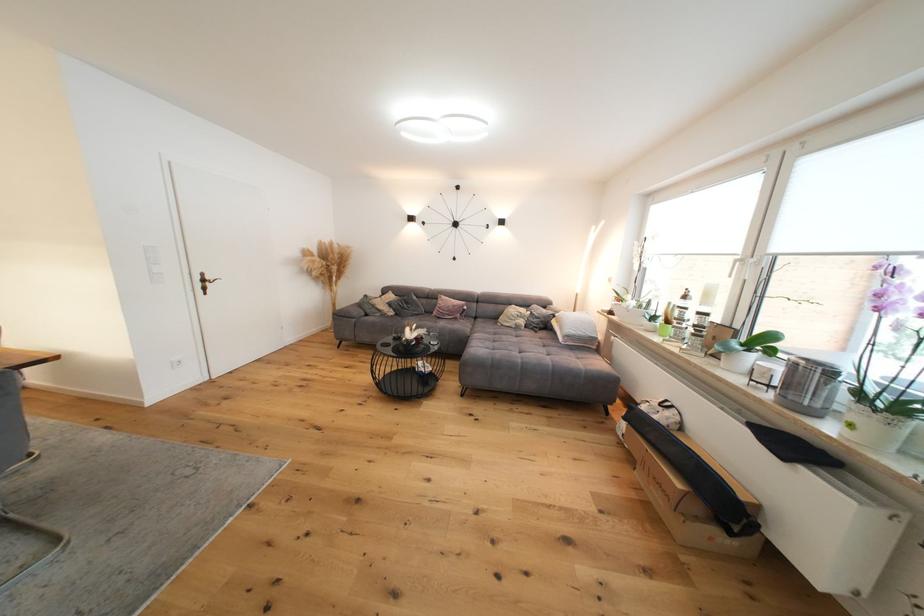
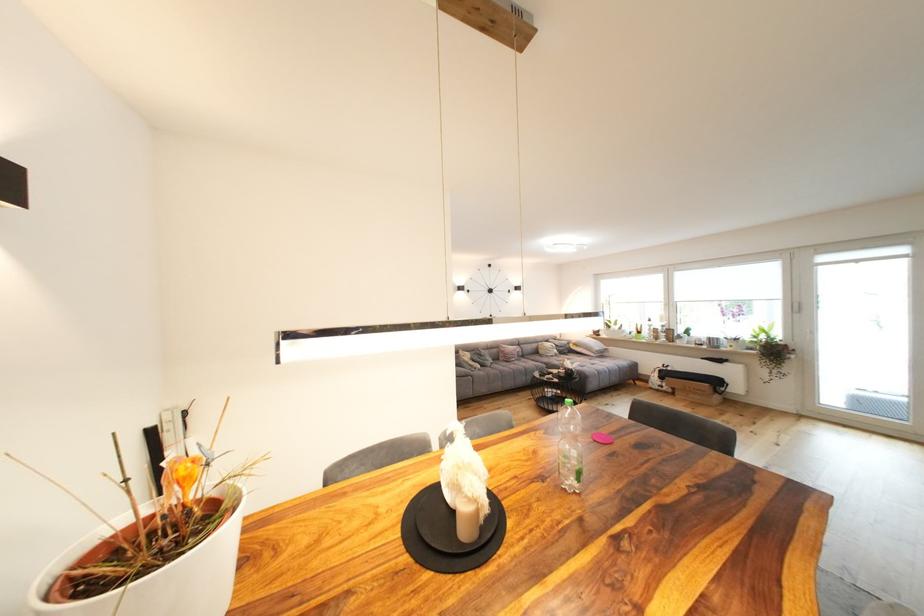
Question: I am providing you with two images of the same scene from different viewpoints. Which of the following objects are not visible in image2?

Choices:
 (A) dark door handle
 (B) pink round coaster
 (C) grey pillow
 (D) grey decorative pillow

Answer: (A)